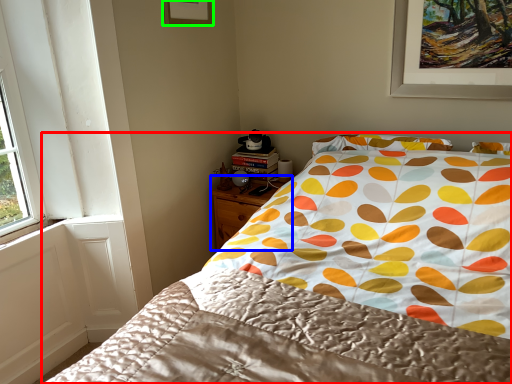
Question: Considering the real-world distances, which object is farthest from bed (highlighted by a red box)? nightstand (highlighted by a blue box) or picture frame (highlighted by a green box)?

Choices:
 (A) nightstand
 (B) picture frame

Answer: (B)